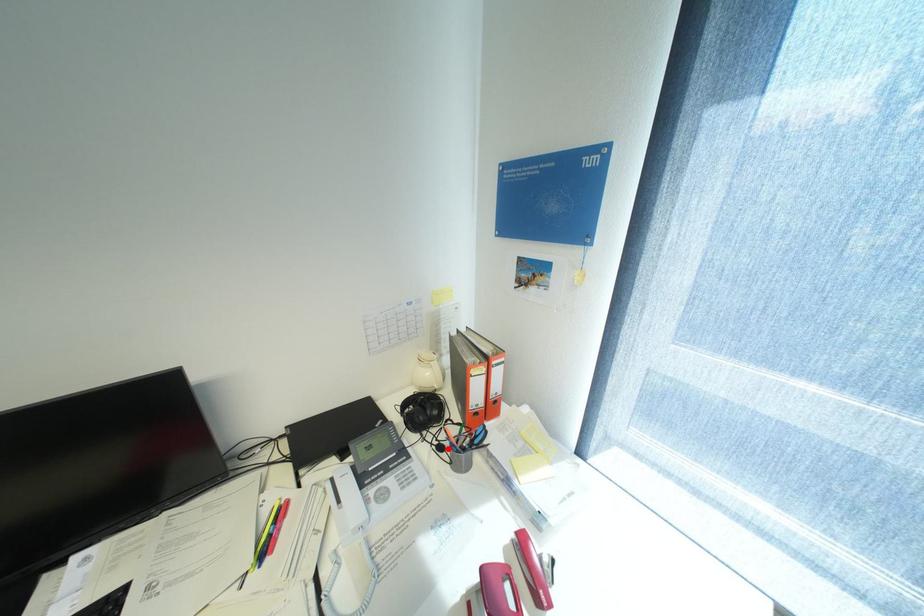
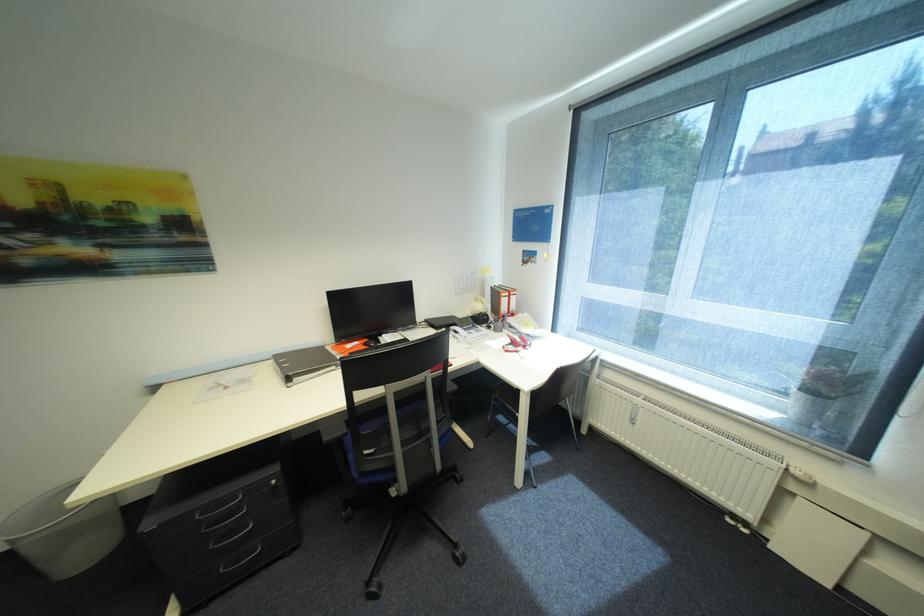
Locate, in the second image, the point that corresponds to the highlighted location in the first image.

(496, 328)